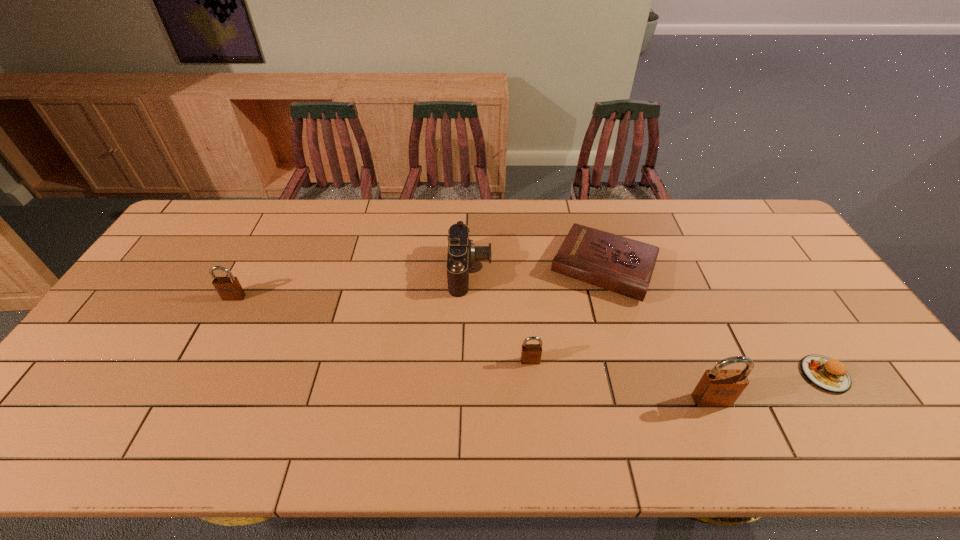
This screenshot has height=540, width=960. What are the coordinates of `the leftmost padlock` in the screenshot? It's located at (229, 288).

Find the location of a particular element. This screenshot has height=540, width=960. the second tallest padlock is located at coordinates (229, 288).

The image size is (960, 540). Find the location of `the fourth tallest object`. the fourth tallest object is located at coordinates (530, 353).

Image resolution: width=960 pixels, height=540 pixels. Identify the location of the third object from left to right. (530, 353).

The image size is (960, 540). What are the coordinates of `the rightmost padlock` in the screenshot? It's located at (717, 388).

Where is `the nearest padlock`? This screenshot has height=540, width=960. the nearest padlock is located at coordinates (717, 388).

Image resolution: width=960 pixels, height=540 pixels. Find the location of `camera`. camera is located at coordinates (462, 253).

I want to click on the shortest object, so click(x=830, y=375).

This screenshot has width=960, height=540. I want to click on patty, so click(830, 375).

At what (x,y) coordinates should I click in order to perform the action: click on hardback book. Please return your answer as a coordinate pair (x, y). Looking at the image, I should click on (622, 265).